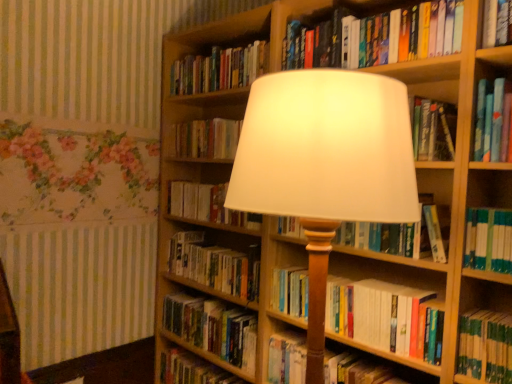
Question: Which direction should I rotate to face hardcover book at upper center, which is the first book in top-to-bottom order, — up or down?

Choices:
 (A) up
 (B) down

Answer: (A)

Question: From a real-world perspective, does hardcover book at center, positioned as the 5th book in bottom-to-top order, sit lower than white paper book at center, positioned as the 6th book in bottom-to-top order?

Choices:
 (A) yes
 (B) no

Answer: (A)

Question: Would you say white paper book at center, the 5th book positioned from the top, is part of hardcover book at center, positioned as the 5th book in bottom-to-top order,'s contents?

Choices:
 (A) no
 (B) yes

Answer: (A)

Question: Can you confirm if hardcover book at center, positioned as the 5th book in bottom-to-top order, is shorter than white paper book at center, positioned as the 6th book in bottom-to-top order?

Choices:
 (A) no
 (B) yes

Answer: (A)

Question: Can you see hardcover book at center, arranged as the 6th book when viewed from the top, touching white paper book at center, the 5th book positioned from the top?

Choices:
 (A) no
 (B) yes

Answer: (A)

Question: Is hardcover book at center, arranged as the 6th book when viewed from the top, thinner than white paper book at center, positioned as the 6th book in bottom-to-top order?

Choices:
 (A) yes
 (B) no

Answer: (B)

Question: Does hardcover book at center, arranged as the 6th book when viewed from the top, have a smaller size compared to white paper book at center, positioned as the 6th book in bottom-to-top order?

Choices:
 (A) no
 (B) yes

Answer: (A)

Question: From a real-world perspective, is hardcover book at upper center, the tenth book ordered from the bottom, positioned over hardcover book at center, which is counted as the eighth book, starting from the bottom, based on gravity?

Choices:
 (A) yes
 (B) no

Answer: (A)

Question: Does hardcover book at upper center, the tenth book ordered from the bottom, have a greater width compared to hardcover book at center, arranged as the third book when viewed from the top?

Choices:
 (A) no
 (B) yes

Answer: (B)

Question: From the image's perspective, is hardcover book at upper center, which is the first book in top-to-bottom order, below hardcover book at center, arranged as the third book when viewed from the top?

Choices:
 (A) no
 (B) yes

Answer: (A)

Question: Is hardcover book at upper center, which is the first book in top-to-bottom order, smaller than hardcover book at center, arranged as the third book when viewed from the top?

Choices:
 (A) yes
 (B) no

Answer: (B)

Question: Is hardcover book at upper center, the tenth book ordered from the bottom, not within hardcover book at center, which is counted as the eighth book, starting from the bottom?

Choices:
 (A) no
 (B) yes

Answer: (B)

Question: Does hardcover book at upper center, the tenth book ordered from the bottom, lie in front of hardcover book at center, arranged as the third book when viewed from the top?

Choices:
 (A) yes
 (B) no

Answer: (A)

Question: Does hardcover book at center, arranged as the ninth book when viewed from the top, have a larger size compared to hardcover book at upper center, the tenth book ordered from the bottom?

Choices:
 (A) no
 (B) yes

Answer: (B)